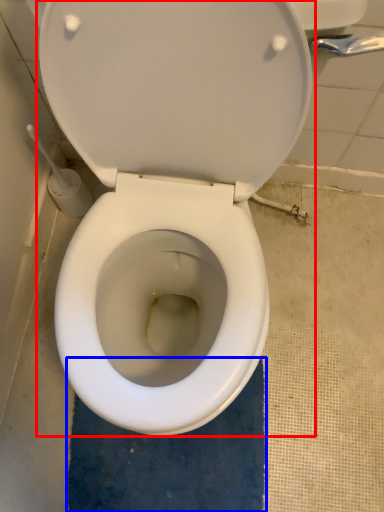
Question: Which object appears closest to the camera in this image, toilet (highlighted by a red box) or bath mat (highlighted by a blue box)?

Choices:
 (A) toilet
 (B) bath mat

Answer: (A)